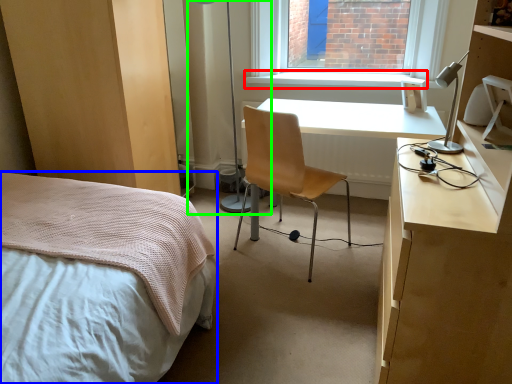
Question: Estimate the real-world distances between objects in this image. Which object is farther from window sill (highlighted by a red box), bed (highlighted by a blue box) or table lamp (highlighted by a green box)?

Choices:
 (A) bed
 (B) table lamp

Answer: (A)